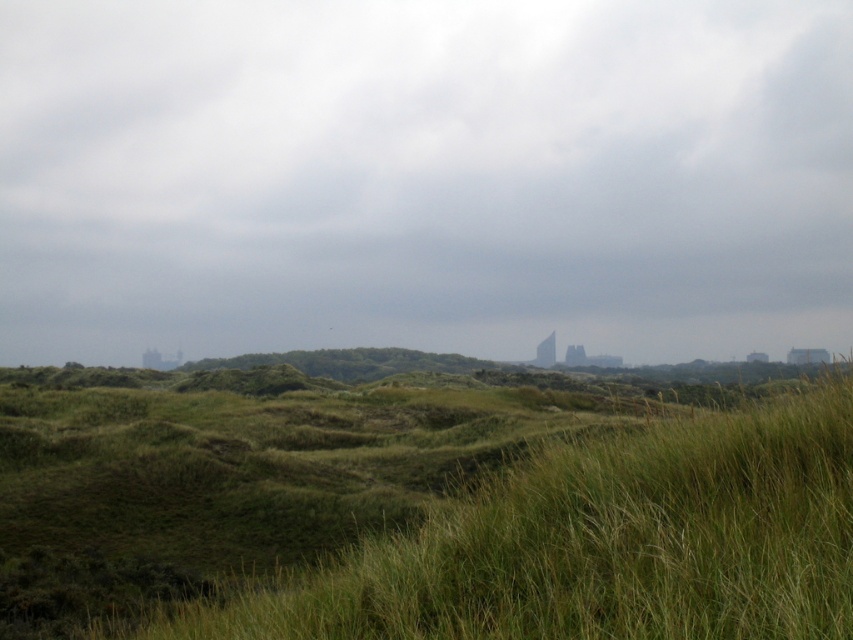
You are an architect planning to build a wind turbine in the green grassy at center. Considering the gray cloudy sky at upper center, which has a wider horizontal span, would the turbine be more likely to experience stronger winds from the direction of the sky or from the direction of the green grassy area?

The gray cloudy sky at upper center has a wider horizontal span than the green grassy at center, so the turbine might experience stronger winds from the direction of the sky as wider areas can channel winds more effectively.

You are standing in the middle of the dunes and looking towards the distant urban skyline. Which object, the gray cloudy sky at upper center or the green grassy at center, appears taller from your perspective?

The gray cloudy sky at upper center appears taller than the green grassy at center from your perspective.

You are standing in the middle of the dunes and looking towards the distant urban skyline. Which object is closer to you between the gray cloudy sky at upper center and the green grassy at center?

The green grassy at center is behind the gray cloudy sky at upper center, so the gray cloudy sky at upper center is closer to you.